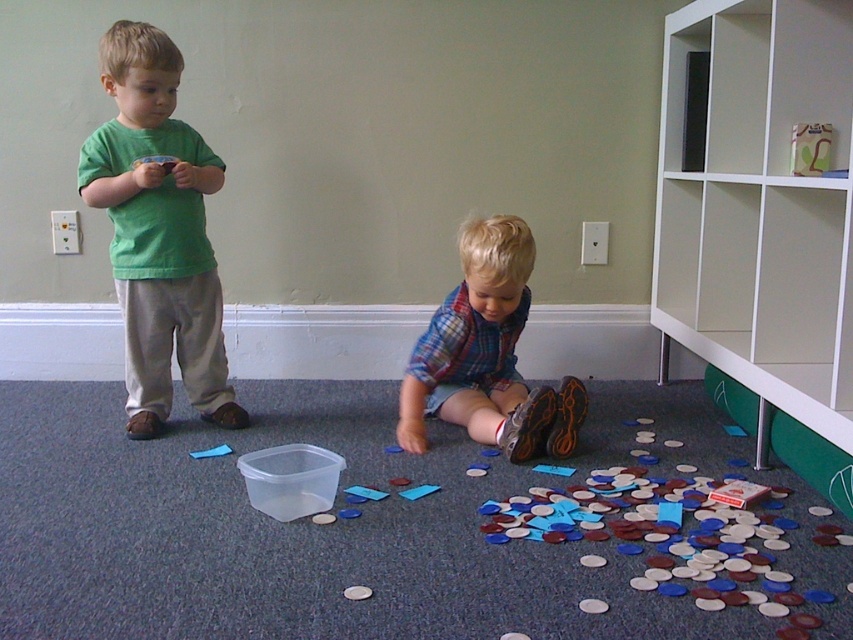
Looking at this image, who is higher up, green matte shirt at left or plaid fabric shirt at lower center?

green matte shirt at left is higher up.

Between point (218, 342) and point (491, 385), which one is positioned behind?

Point (491, 385)

The width and height of the screenshot is (853, 640). In order to click on green matte shirt at left in this screenshot , I will do `click(158, 232)`.